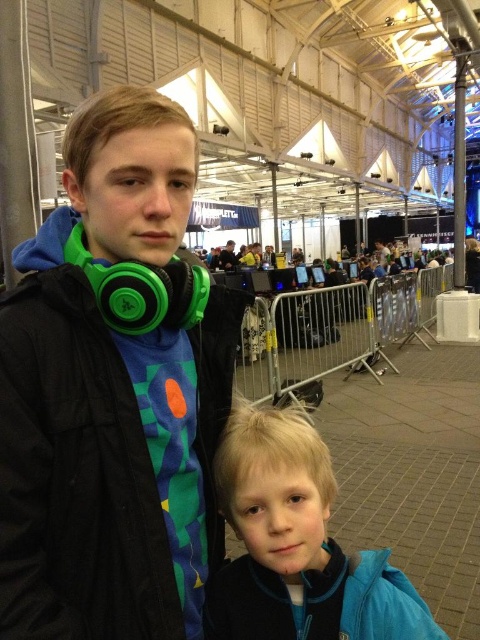
You are a photographer setting up a tripod in this venue. You need to position it so that both the green matte headphones at upper left and the blue fleece jacket at lower right are visible in the frame. Considering their sizes, which object should you ensure is closer to the camera to avoid it being blocked by the other?

The green matte headphones at upper left is much taller than the blue fleece jacket at lower right. To prevent the taller headphones from blocking the jacket, position the tripod so that the blue fleece jacket at lower right is closer to the camera.